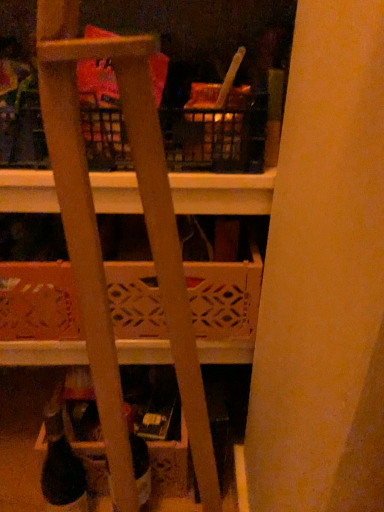
Question: From a real-world perspective, is matte plastic bottle at lower center positioned above or below black matte wine bottle at lower left?

Choices:
 (A) above
 (B) below

Answer: (B)

Question: From the image's perspective, is matte plastic bottle at lower center located above or below black matte wine bottle at lower left?

Choices:
 (A) below
 (B) above

Answer: (A)

Question: Estimate the real-world distances between objects in this image. Which object is farther from the wooden lattice basket at center?

Choices:
 (A) wooden ladder at center
 (B) matte plastic bottle at lower center
 (C) black matte wine bottle at lower left

Answer: (B)

Question: Considering the real-world distances, which object is farthest from the wooden ladder at center?

Choices:
 (A) wooden lattice basket at center
 (B) black matte wine bottle at lower left
 (C) matte plastic bottle at lower center

Answer: (C)